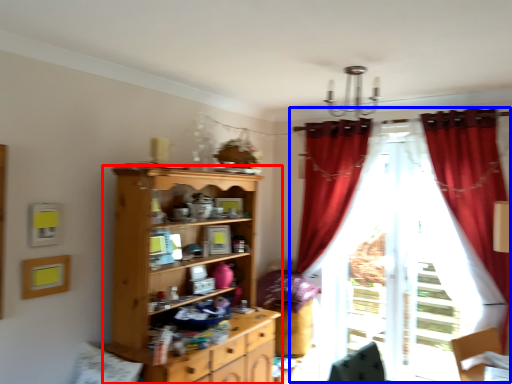
Question: Which object is closer to the camera taking this photo, cupboard (highlighted by a red box) or curtain (highlighted by a blue box)?

Choices:
 (A) cupboard
 (B) curtain

Answer: (A)